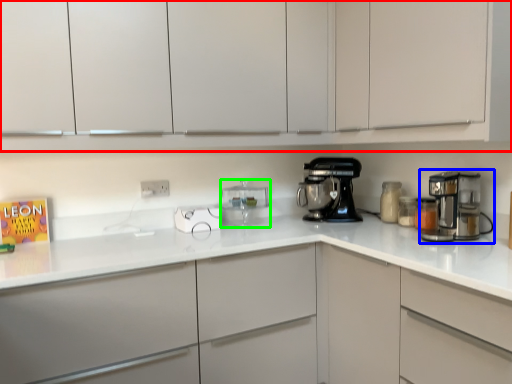
Question: Estimate the real-world distances between objects in this image. Which object is farther from cabinetry (highlighted by a red box), mixer (highlighted by a blue box) or kitchen appliance (highlighted by a green box)?

Choices:
 (A) mixer
 (B) kitchen appliance

Answer: (B)